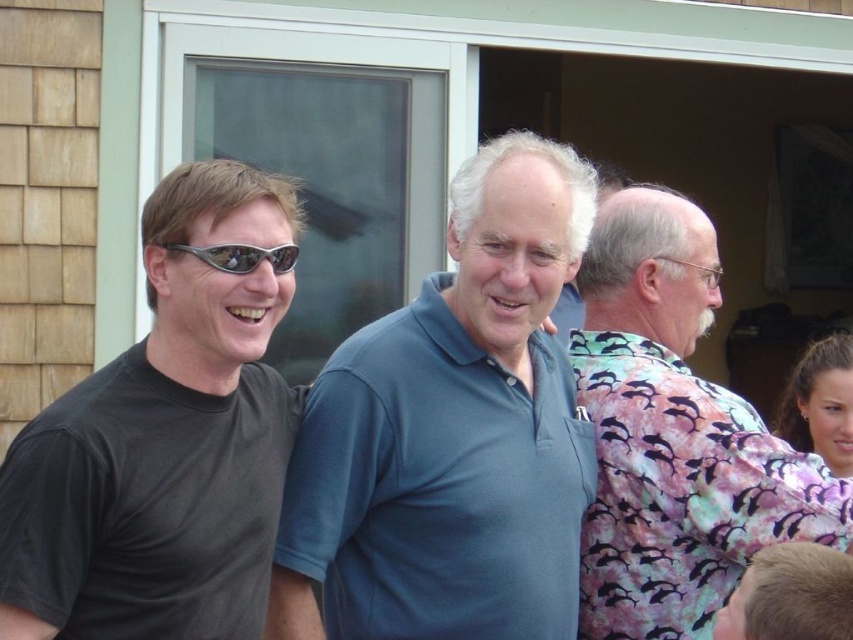
Between point (537, 216) and point (592, 378), which one is positioned in front?

Point (537, 216) is more forward.

Consider the image. Is blue cotton polo shirt at center bigger than pink dolphin-patterned shirt at right?

Correct, blue cotton polo shirt at center is larger in size than pink dolphin-patterned shirt at right.

Does point (453, 348) come behind point (737, 481)?

No.

Find the location of `blue cotton polo shirt at center`. blue cotton polo shirt at center is located at coordinates (x=451, y=433).

Who is more forward, (502, 396) or (247, 568)?

Point (247, 568) is more forward.

Looking at this image, who is lower down, blue cotton polo shirt at center or black matte t-shirt at left?

blue cotton polo shirt at center

The height and width of the screenshot is (640, 853). What are the coordinates of `blue cotton polo shirt at center` in the screenshot? It's located at (451, 433).

Who is more distant from viewer, (506, 172) or (252, 257)?

The point (506, 172) is more distant.

How distant is blue cotton polo shirt at center from sunglasses at center?

blue cotton polo shirt at center and sunglasses at center are 22.00 inches apart from each other.

Does point (432, 545) come closer to viewer compared to point (207, 248)?

No, (432, 545) is behind (207, 248).

Identify the location of blue cotton polo shirt at center. (451, 433).